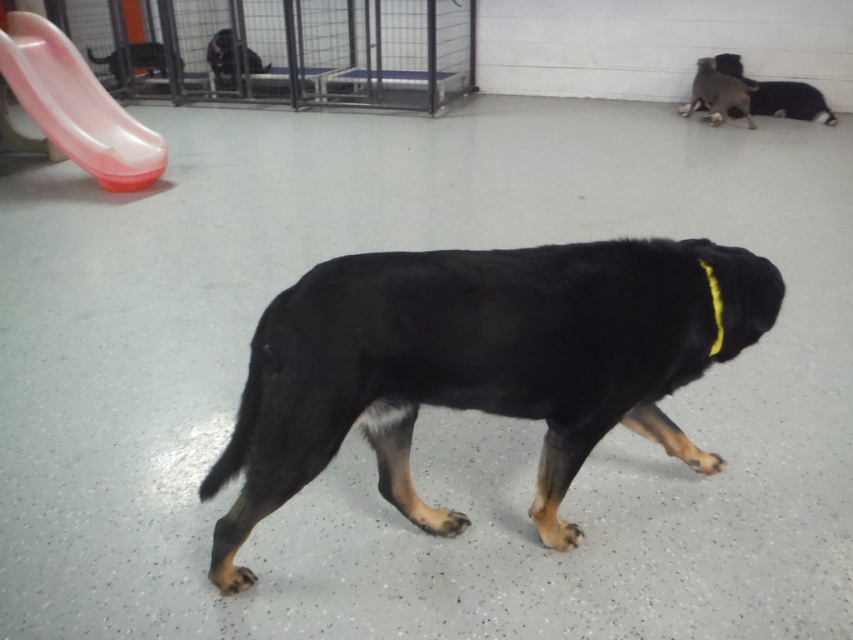
Consider the image. You are a volunteer at the kennel and need to identify the black fur dog at upper right. Where is its yellow fabric neckband at upper right relative to the dog?

The yellow fabric neckband at upper right is located below the black fur dog at upper right.

You are a visitor at the kennel and want to play with the black fur dog at upper right. To reach it, you need to walk around the matte plastic slide at upper left. Since the slide is in your way, will you have to go around it to your left or right side?

The matte plastic slide at upper left is taller than black fur dog at upper right. Since the slide is taller, you would need to go around it to either side. However, the exact direction isn answer provide in the description, so you can choose either left or right based on the layout.

You are a caretaker in the kennel and need to secure the black fur dog at upper right with its yellow fabric neckband at upper right. Given that the neckband has a 5 meter leash, will the dog have enough room to move freely without the leash becoming taut?

The black fur dog at upper right is 5.23 meters from the yellow fabric neckband at upper right. Since the leash is only 5 meters long, the distance is greater than the leash length, meaning the dog cannot reach the neckband without the leash becoming taut. Therefore, the dog does not have enough room to move freely.